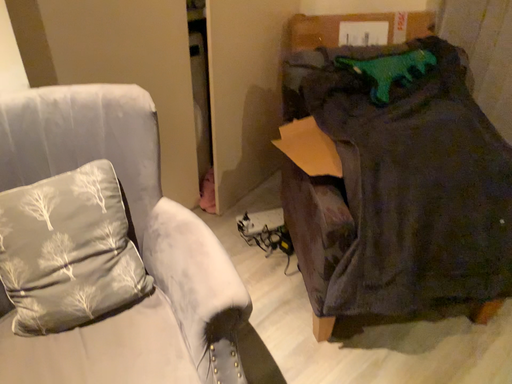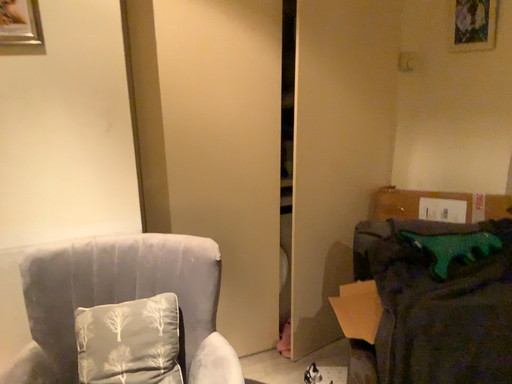
Question: Which way did the camera rotate in the video?

Choices:
 (A) rotated right
 (B) rotated left

Answer: (B)